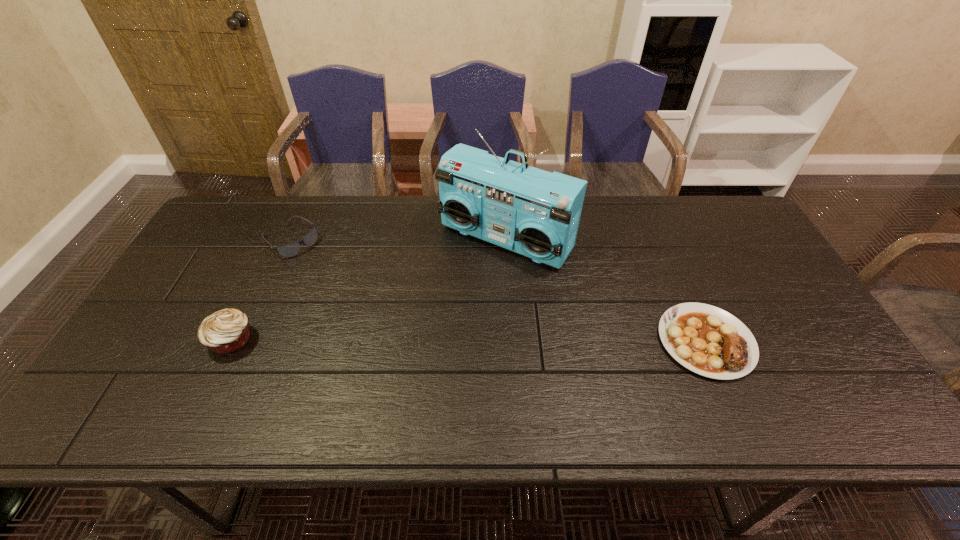
At what (x,y) coordinates should I click in order to perform the action: click on muffin. Please return your answer as a coordinate pair (x, y). The width and height of the screenshot is (960, 540). Looking at the image, I should click on (226, 331).

This screenshot has height=540, width=960. I want to click on steak, so click(x=707, y=340).

Locate an element on the screen. The height and width of the screenshot is (540, 960). the second object from right to left is located at coordinates (536, 213).

Identify the location of radio receiver. The image size is (960, 540). (536, 213).

I want to click on sunglasses, so click(x=288, y=250).

The height and width of the screenshot is (540, 960). Find the location of `vacant space located on the back of the third shortest object`. vacant space located on the back of the third shortest object is located at coordinates (276, 249).

Where is `free space located on the back of the rightmost object`? The image size is (960, 540). free space located on the back of the rightmost object is located at coordinates (666, 251).

You are a GUI agent. You are given a task and a screenshot of the screen. Output one action in this format:
    pyautogui.click(x=<x>, y=<y>)
    Task: Click on the free spot located 0.170m on the front-facing side of the third object from left to right
    This screenshot has height=540, width=960.
    Given the screenshot: What is the action you would take?
    pyautogui.click(x=439, y=310)

Identify the location of vacant position located 0.310m on the front-facing side of the third object from left to right. The width and height of the screenshot is (960, 540). (408, 347).

Locate an element on the screen. The image size is (960, 540). free space located on the front-facing side of the third object from left to right is located at coordinates (455, 291).